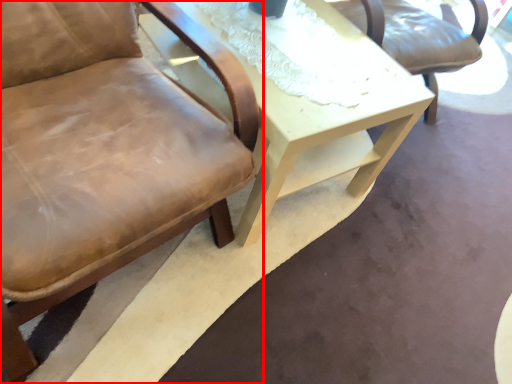
Question: From the image's perspective, what is the correct spatial positioning of chair (annotated by the red box) in reference to table?

Choices:
 (A) above
 (B) below

Answer: (B)